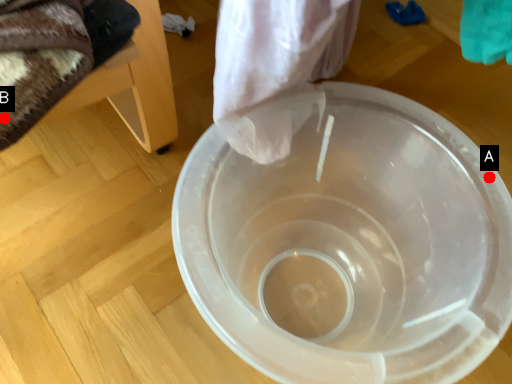
Question: Two points are circled on the image, labeled by A and B beside each circle. Which point is closer to the camera?

Choices:
 (A) A is closer
 (B) B is closer

Answer: (B)